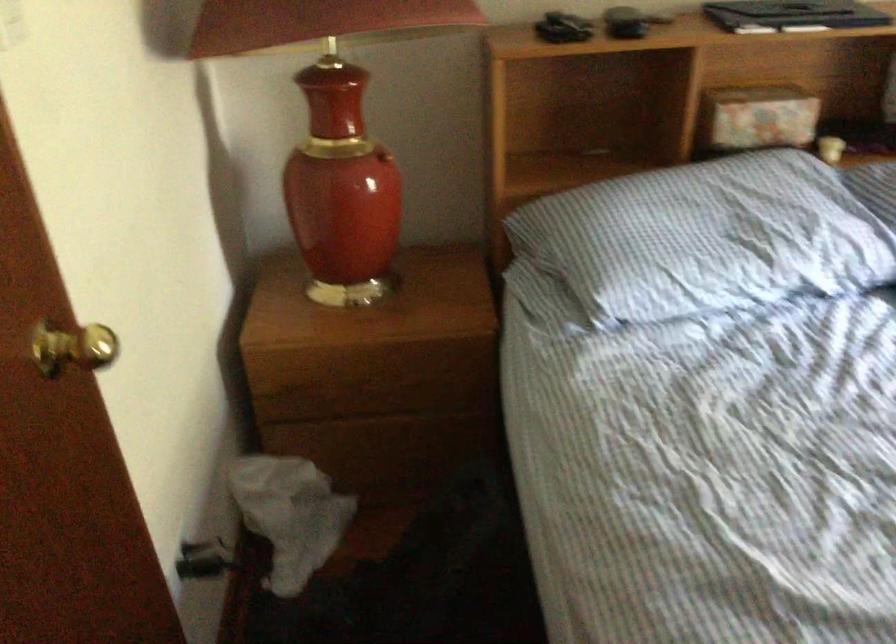
Image resolution: width=896 pixels, height=644 pixels. Describe the element at coordinates (73, 348) in the screenshot. I see `the gold door knob` at that location.